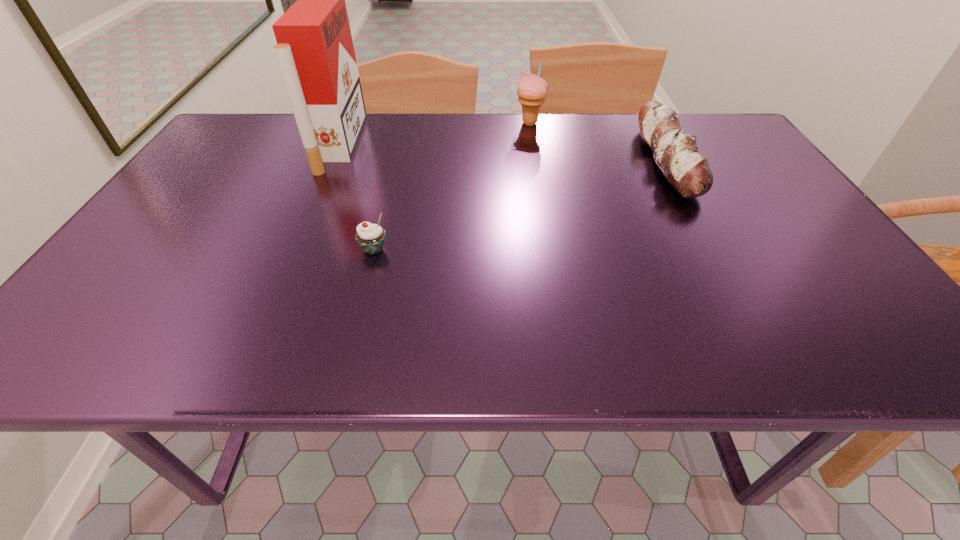
Where is `free space located on the front of the cupcake`? free space located on the front of the cupcake is located at coordinates (348, 349).

I want to click on cigarette case located in the far edge section of the desktop, so click(315, 52).

Locate an element on the screen. The height and width of the screenshot is (540, 960). icecream positioned at the far edge is located at coordinates (531, 89).

The height and width of the screenshot is (540, 960). Find the location of `baguet positioned at the far edge`. baguet positioned at the far edge is located at coordinates pos(676,153).

Find the location of a particular element. Image resolution: width=960 pixels, height=540 pixels. free spot at the far edge of the desktop is located at coordinates (477, 128).

I want to click on vacant space at the near edge of the desktop, so click(x=499, y=330).

What are the coordinates of `vacant space at the left edge of the desktop` in the screenshot? It's located at (132, 246).

I want to click on free spot at the right edge of the desktop, so click(x=847, y=286).

Locate an element on the screen. vacant space at the far left corner of the desktop is located at coordinates (234, 139).

Where is `vacant area that lies between the tallest object and the cupcake`? This screenshot has width=960, height=540. vacant area that lies between the tallest object and the cupcake is located at coordinates (356, 197).